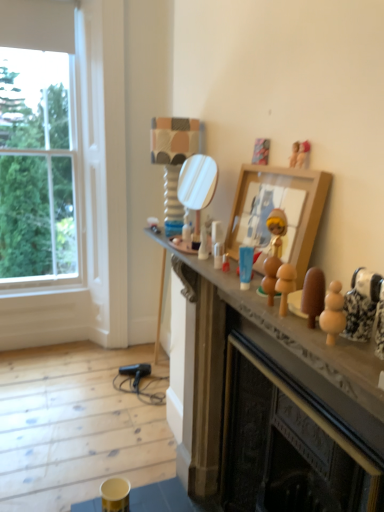
Question: Is wooden figurines at center shorter than wooden figurine at upper center, arranged as the 3th toy when viewed from the right?

Choices:
 (A) no
 (B) yes

Answer: (A)

Question: Is wooden figurines at center in front of wooden figurine at upper center, which appears as the 3th toy when viewed from the left?

Choices:
 (A) yes
 (B) no

Answer: (A)

Question: From the image's perspective, is wooden figurines at center under wooden figurine at upper center, arranged as the 3th toy when viewed from the right?

Choices:
 (A) yes
 (B) no

Answer: (A)

Question: Is the surface of wooden figurines at center in direct contact with wooden figurine at upper center, which appears as the 3th toy when viewed from the left?

Choices:
 (A) no
 (B) yes

Answer: (A)

Question: Does wooden figurines at center have a lesser width compared to wooden figurine at upper center, the second toy when ordered from back to front?

Choices:
 (A) yes
 (B) no

Answer: (B)

Question: Is wooden figurines at center located outside wooden figurine at upper center, the second toy when ordered from back to front?

Choices:
 (A) yes
 (B) no

Answer: (A)

Question: Is wooden picture frame at upper center with clear glass window at left?

Choices:
 (A) no
 (B) yes

Answer: (A)

Question: Could clear glass window at left be considered to be inside wooden picture frame at upper center?

Choices:
 (A) yes
 (B) no

Answer: (B)

Question: Is the position of wooden picture frame at upper center less distant than that of clear glass window at left?

Choices:
 (A) no
 (B) yes

Answer: (B)

Question: Can you confirm if wooden picture frame at upper center is thinner than clear glass window at left?

Choices:
 (A) yes
 (B) no

Answer: (A)

Question: Is wooden picture frame at upper center aimed at clear glass window at left?

Choices:
 (A) yes
 (B) no

Answer: (B)

Question: Considering the relative positions of wooden picture frame at upper center and clear glass window at left in the image provided, is wooden picture frame at upper center to the left of clear glass window at left from the viewer's perspective?

Choices:
 (A) yes
 (B) no

Answer: (B)

Question: Considering the relative sizes of clear glass window at left and wooden toy at center, which appears as the fourth toy when viewed from the back, in the image provided, is clear glass window at left shorter than wooden toy at center, which appears as the fourth toy when viewed from the back,?

Choices:
 (A) yes
 (B) no

Answer: (B)